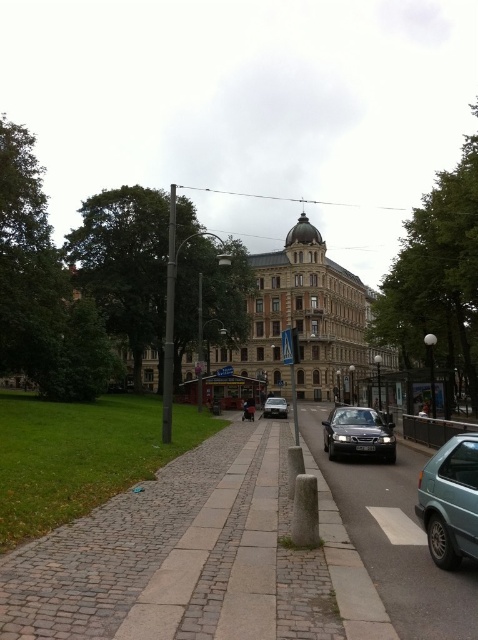
Is teal matte hatchback at right below silver metallic van at center?

Actually, teal matte hatchback at right is above silver metallic van at center.

Which is above, teal matte hatchback at right or silver metallic van at center?

teal matte hatchback at right is above.

Is point (437, 529) less distant than point (284, 401)?

Yes, point (437, 529) is in front of point (284, 401).

Find the location of a particular element. This screenshot has height=640, width=478. teal matte hatchback at right is located at coordinates (451, 500).

Who is shorter, gray concrete pavement at center or shiny black car at center?

With less height is gray concrete pavement at center.

Can you confirm if gray concrete pavement at center is positioned below shiny black car at center?

Indeed, gray concrete pavement at center is positioned under shiny black car at center.

Is point (358, 520) behind point (370, 429)?

No, (358, 520) is in front of (370, 429).

The image size is (478, 640). I want to click on gray concrete pavement at center, so [394, 540].

Between gray concrete pavement at center and teal matte hatchback at right, which one is positioned higher?

teal matte hatchback at right is higher up.

Which of these two, gray concrete pavement at center or teal matte hatchback at right, stands taller?

teal matte hatchback at right

What do you see at coordinates (394, 540) in the screenshot?
I see `gray concrete pavement at center` at bounding box center [394, 540].

Where is `gray concrete pavement at center`? gray concrete pavement at center is located at coordinates (394, 540).